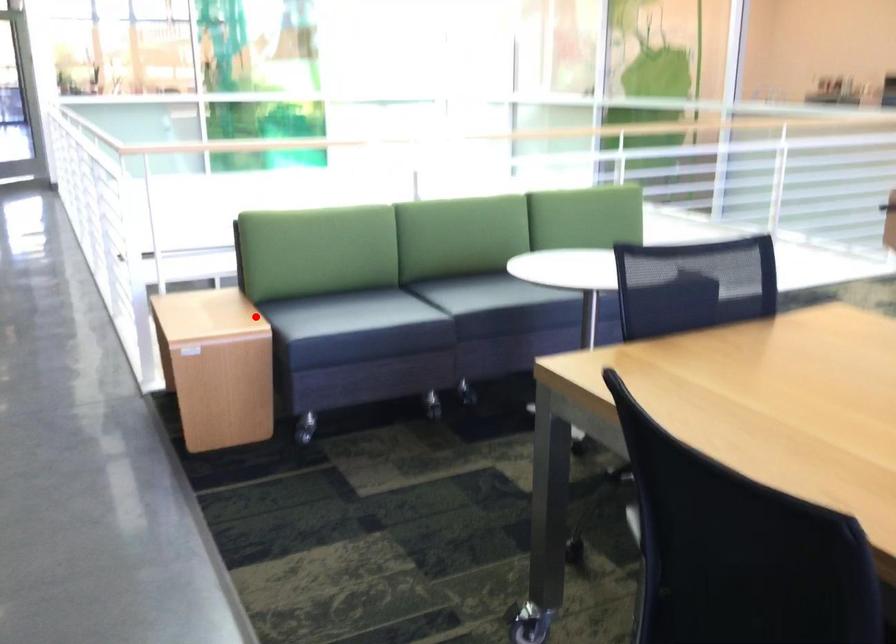
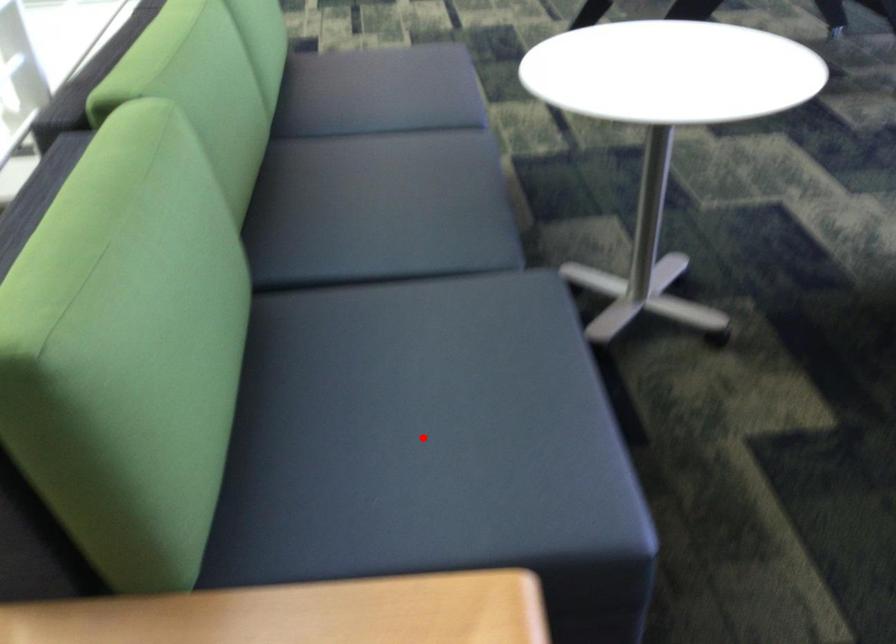
I am providing you with two images of the same scene from different viewpoints. A red point is marked on the first image and another point is marked on the second image. Does the point marked in image1 correspond to the same location as the one in image2?

Yes